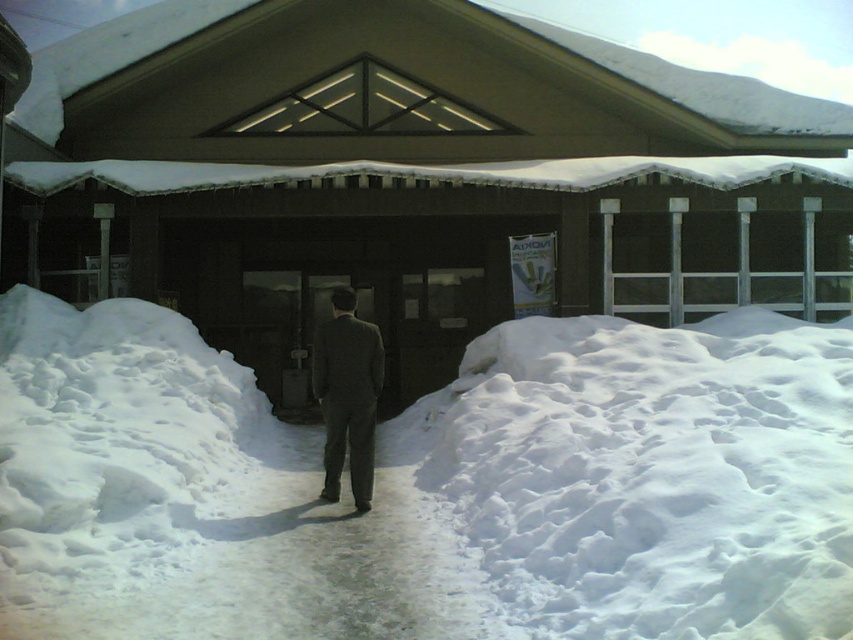
Question: Is white fluffy snow at center closer to camera compared to dark gray suit at center?

Choices:
 (A) no
 (B) yes

Answer: (B)

Question: Is the position of white fluffy snow at center less distant than that of dark gray suit at center?

Choices:
 (A) yes
 (B) no

Answer: (A)

Question: Which object appears farthest from the camera in this image?

Choices:
 (A) brown wooden hut at center
 (B) white fluffy snow at center
 (C) dark gray suit at center

Answer: (A)

Question: Which point is closer to the camera?

Choices:
 (A) (437, 486)
 (B) (277, 115)

Answer: (A)

Question: Is the position of white fluffy snow at center less distant than that of dark gray suit at center?

Choices:
 (A) yes
 (B) no

Answer: (A)

Question: Among these points, which one is nearest to the camera?

Choices:
 (A) (154, 564)
 (B) (793, 234)

Answer: (A)